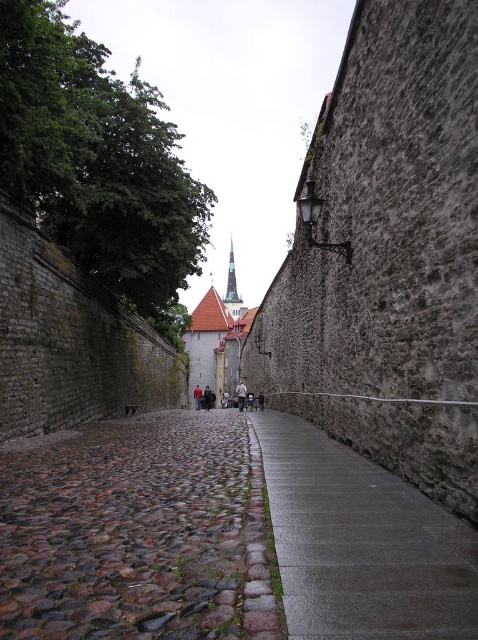
Question: Is brown cobblestone pavement at center positioned behind gray concrete pavement at center?

Choices:
 (A) yes
 (B) no

Answer: (A)

Question: Based on their relative distances, which object is farther from the gray concrete pavement at center?

Choices:
 (A) smooth gray stone tower at center
 (B) brown cobblestone pavement at center

Answer: (A)

Question: Among these objects, which one is nearest to the camera?

Choices:
 (A) brown cobblestone pavement at center
 (B) gray concrete pavement at center
 (C) smooth gray stone tower at center

Answer: (B)

Question: Is brown cobblestone pavement at center to the right of smooth gray stone tower at center from the viewer's perspective?

Choices:
 (A) no
 (B) yes

Answer: (A)

Question: Observing the image, what is the correct spatial positioning of brown cobblestone pavement at center in reference to gray concrete pavement at center?

Choices:
 (A) right
 (B) left

Answer: (B)

Question: Among these points, which one is nearest to the camera?

Choices:
 (A) (286, 593)
 (B) (228, 301)

Answer: (A)